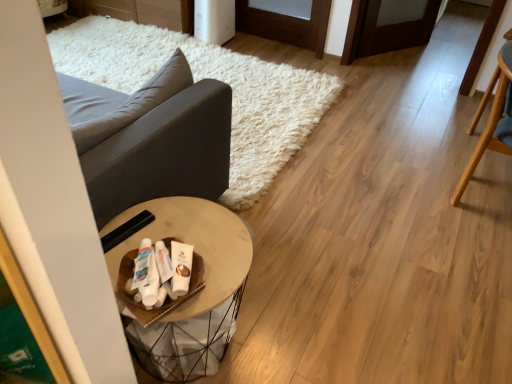
Identify the location of empty space that is to the right of white matte lotion at center, arranged as the first toiletry when viewed from the right. (226, 274).